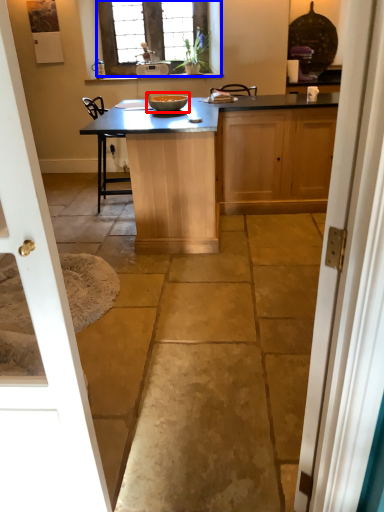
Question: Among these objects, which one is farthest to the camera, glass bowl (highlighted by a red box) or window (highlighted by a blue box)?

Choices:
 (A) glass bowl
 (B) window

Answer: (B)